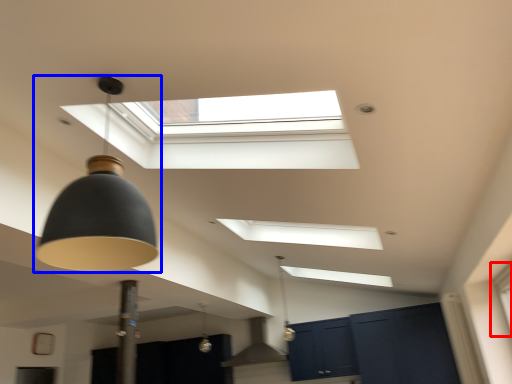
Question: Which object appears farthest to the camera in this image, window (highlighted by a red box) or lamp (highlighted by a blue box)?

Choices:
 (A) window
 (B) lamp

Answer: (A)